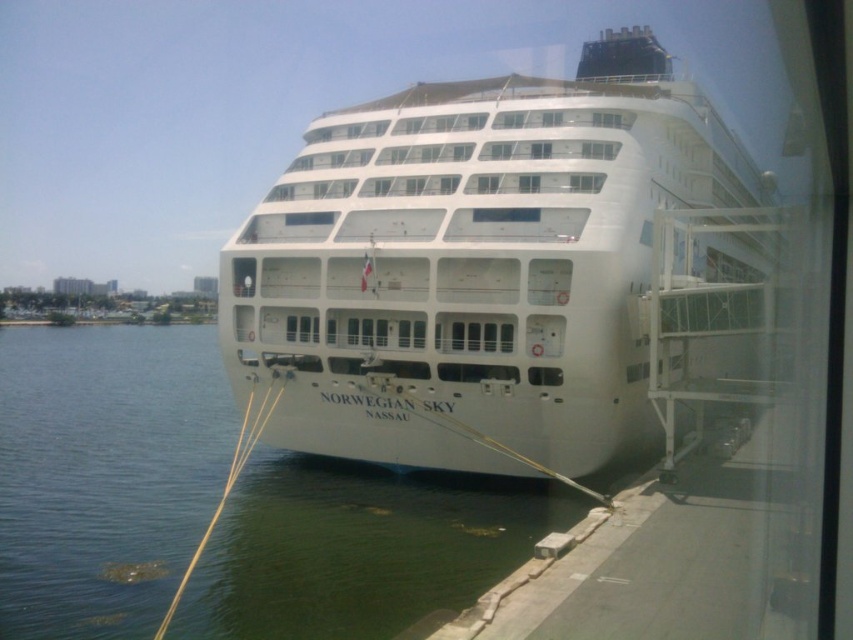
You are standing on the pier next to the white glossy cruise ship at center. You want to take a photo of the ship with your phone. The recommended distance for clear photos is at least 100 feet. Is your current position far enough to take a clear photo?

The white glossy cruise ship at center and camera are 78.42 feet apart from each other. Since the recommended distance is at least 100 feet, your current position is not far enough to take a clear photo.

You are a photographer standing on the pier next to the Norwegian Sky. You want to take a photo that includes both the white glossy cruise ship at center and the clear water at lower left. Based on their positions, which object should appear higher in your photo?

The white glossy cruise ship at center appears higher in the photo because it is positioned above the clear water at lower left.